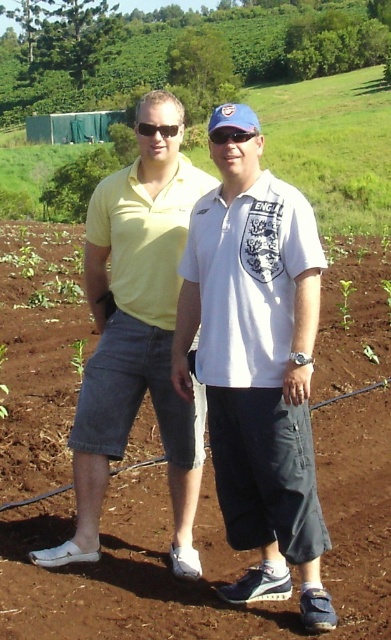
Is white cotton shirt at center to the left of sunglasses at center from the viewer's perspective?

Correct, you'll find white cotton shirt at center to the left of sunglasses at center.

Between white cotton shirt at center and sunglasses at center, which one is positioned lower?

white cotton shirt at center is lower down.

Does point (288, 404) lie behind point (225, 134)?

No, (288, 404) is closer to viewer.

The image size is (391, 640). I want to click on white cotton shirt at center, so click(256, 364).